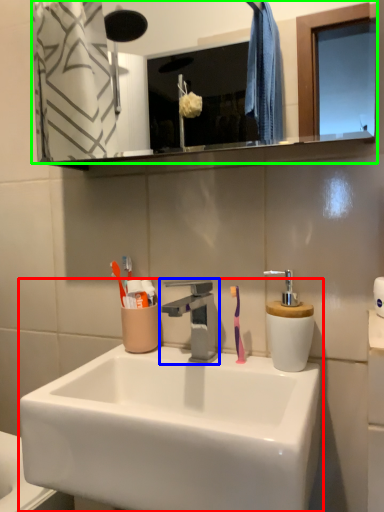
Question: Which object is positioned closest to sink (highlighted by a red box)? Select from tap (highlighted by a blue box) and mirror (highlighted by a green box).

Choices:
 (A) tap
 (B) mirror

Answer: (A)